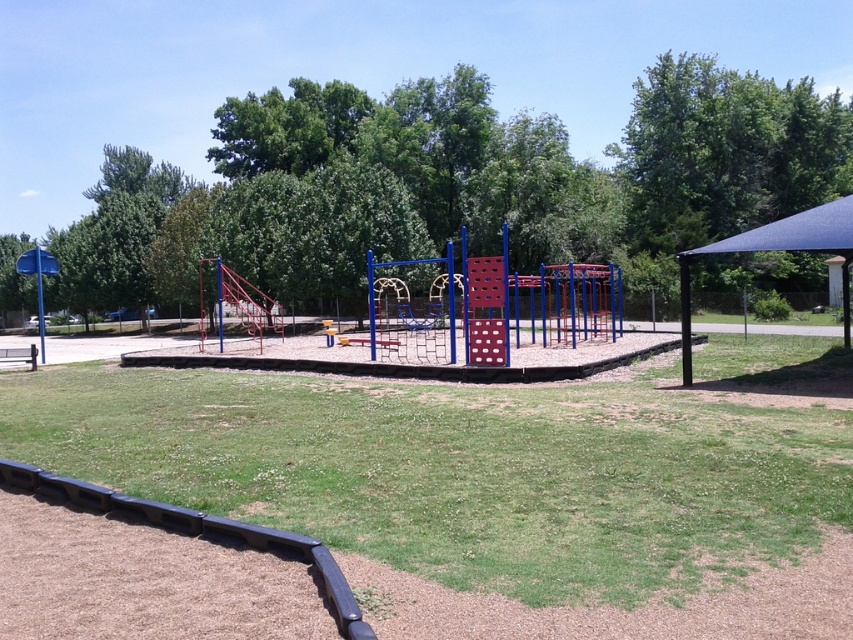
You are a parent watching your child play in the playground. You notice the green leafy tree at center and the blue fabric canopy at right. Which object is positioned higher in the image?

The green leafy tree at center is located above the blue fabric canopy at right, so it is positioned higher in the image.

You are a parent trying to find shade for your child. You see the green leafy tree at center and the blue fabric canopy at right. Which one is closer to the playground equipment?

The blue fabric canopy at right is closer to the playground equipment because it is positioned to the right of the green leafy tree at center, which is further left.